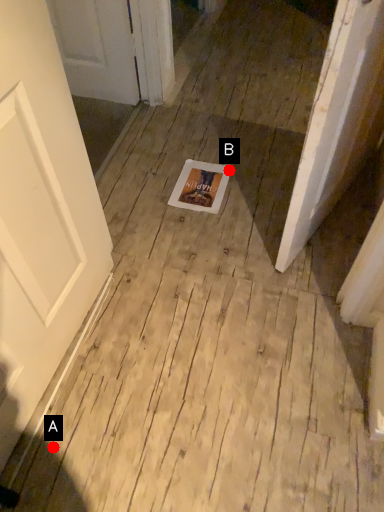
Question: Two points are circled on the image, labeled by A and B beside each circle. Which point appears closest to the camera in this image?

Choices:
 (A) A is closer
 (B) B is closer

Answer: (A)